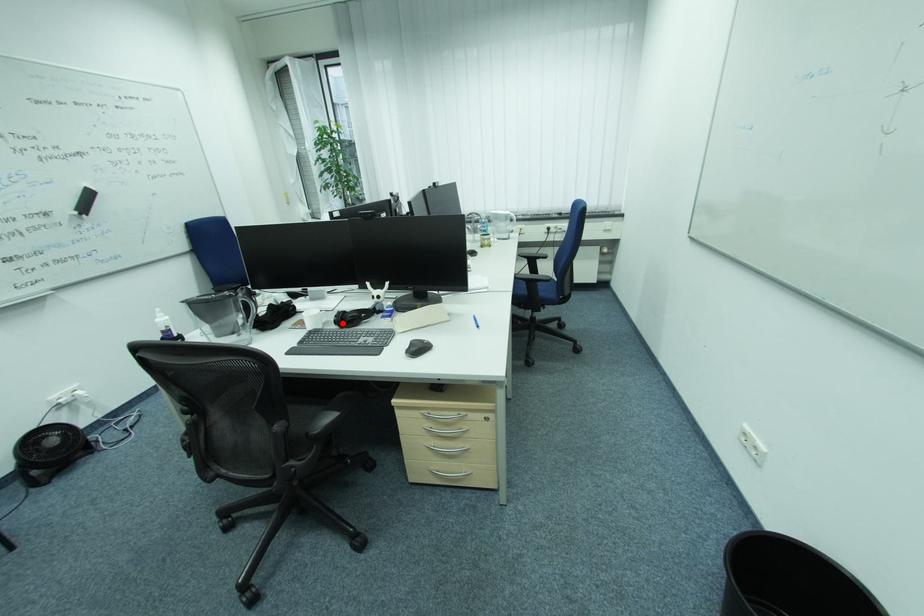
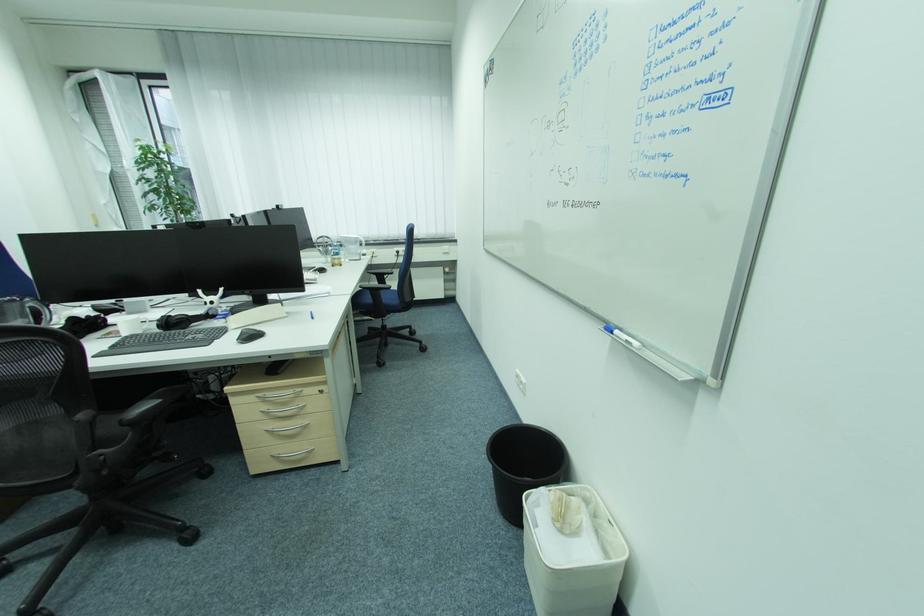
Find the pixel in the second image that matches the highlighted location in the first image.

(166, 328)